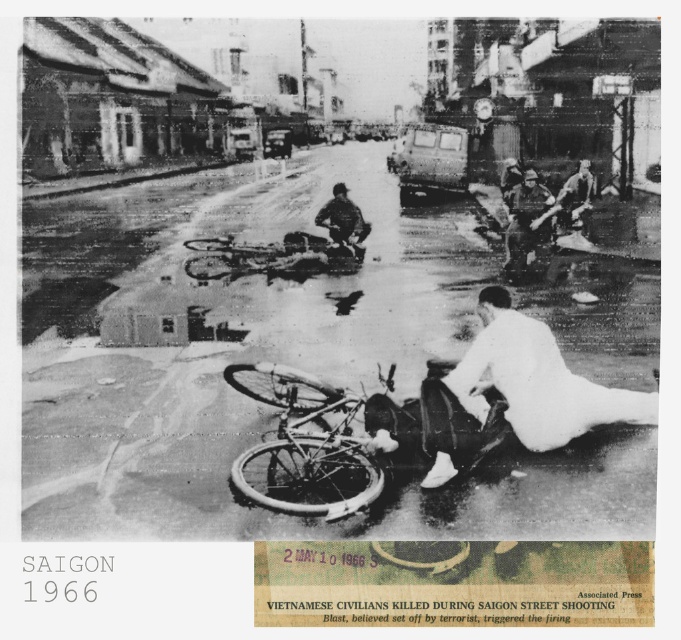
Question: Among these points, which one is nearest to the camera?

Choices:
 (A) (319, 392)
 (B) (340, 483)

Answer: (B)

Question: Is white matte shirt at lower right bigger than white rubber tire at center?

Choices:
 (A) yes
 (B) no

Answer: (A)

Question: Among these points, which one is nearest to the camera?

Choices:
 (A) (355, 509)
 (B) (326, 225)
 (C) (283, 504)

Answer: (C)

Question: Can you confirm if camouflage fabric uniform at center is thinner than dark gray uniform at center?

Choices:
 (A) no
 (B) yes

Answer: (B)

Question: Which object is positioned farthest from the dark gray uniform at center?

Choices:
 (A) white rubber tire at center
 (B) white matte shirt at lower right
 (C) camouflage fabric uniform at center
 (D) white matte bicycle at center

Answer: (A)

Question: Can you confirm if white matte shirt at lower right is bigger than camouflage fabric uniform at center?

Choices:
 (A) no
 (B) yes

Answer: (B)